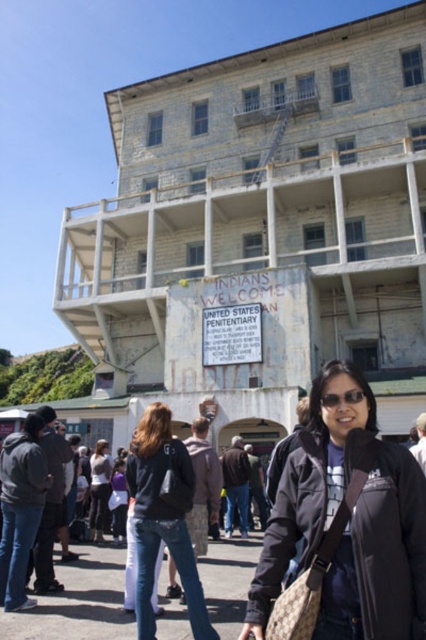
You are standing at the entrance of the historic building and notice the black matte jacket at lower right. Where is the jacket positioned relative to the building?

The black matte jacket at lower right is located at point (342, 528) relative to the building, which places it near the lower right corner of the structure.

You are a costume designer preparing for a historical drama set in the 1920s. You have two items from the scene depicted outside the historic building described above. The items are the black matte jacket at lower right and the denim jeans at center. Which item has a greater width when laid flat?

The black matte jacket at lower right has a greater width than the denim jeans at center when laid flat, as stated in the description.

Consider the image. You are a visitor standing at the entrance of the historic building. You see a black matte jacket at lower right and denim jeans at center. Which object is closer to you?

The denim jeans at center is closer to you since the black matte jacket at lower right is 6.45 meters away from it.